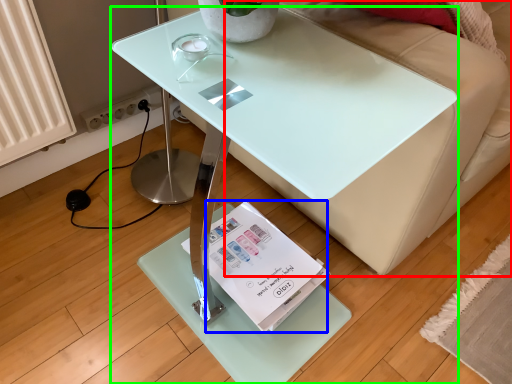
Question: Estimate the real-world distances between objects in this image. Which object is farther from couch (highlighted by a red box), magazine (highlighted by a blue box) or table (highlighted by a green box)?

Choices:
 (A) magazine
 (B) table

Answer: (A)